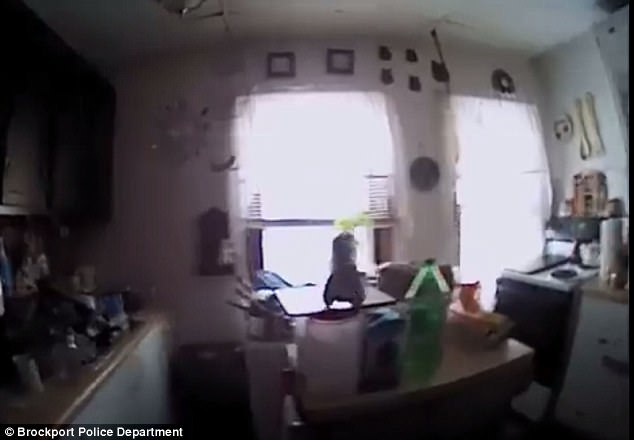
In order to click on cupboards in this screenshot , I will do `click(29, 118)`, `click(96, 120)`.